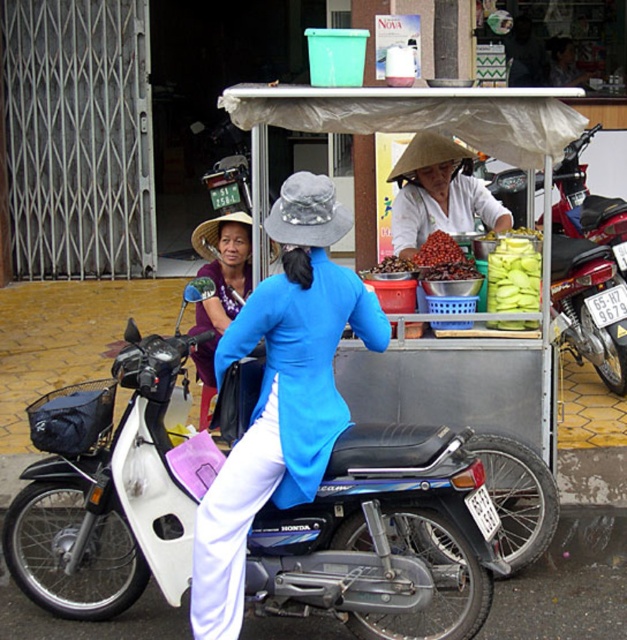
Is metallic red motorcycle at center bigger than matte purple dress at center?

Yes.

Can you confirm if metallic red motorcycle at center is positioned to the right of matte purple dress at center?

Correct, you'll find metallic red motorcycle at center to the right of matte purple dress at center.

Between point (606, 259) and point (204, 246), which one is positioned behind?

The point (606, 259) is more distant.

You are a GUI agent. You are given a task and a screenshot of the screen. Output one action in this format:
    pyautogui.click(x=<x>, y=<y>)
    Task: Click on the metallic red motorcycle at center
    
    Given the screenshot: What is the action you would take?
    pyautogui.click(x=587, y=280)

Can you confirm if metallic red motorcycle at center is positioned to the right of green matte plastic bag at center?

Indeed, metallic red motorcycle at center is positioned on the right side of green matte plastic bag at center.

Consider the image. Does metallic red motorcycle at center have a lesser width compared to green matte plastic bag at center?

In fact, metallic red motorcycle at center might be wider than green matte plastic bag at center.

Is point (577, 266) positioned before point (487, 278)?

No.

Find the location of a particular element. metallic red motorcycle at center is located at coordinates (587, 280).

Does metallic red motorcycle at center have a larger size compared to shiny red dried beans at center?

Yes, metallic red motorcycle at center is bigger than shiny red dried beans at center.

Consider the image. Who is higher up, metallic red motorcycle at center or shiny red dried beans at center?

Positioned higher is metallic red motorcycle at center.

Is point (604, 296) positioned in front of point (443, 244)?

No, it is not.

The image size is (627, 640). Identify the location of metallic red motorcycle at center. [587, 280].